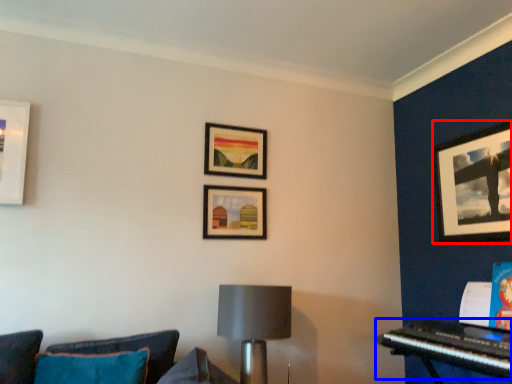
Question: Which point is further to the camera, picture frame (highlighted by a red box) or piano (highlighted by a blue box)?

Choices:
 (A) picture frame
 (B) piano

Answer: (A)